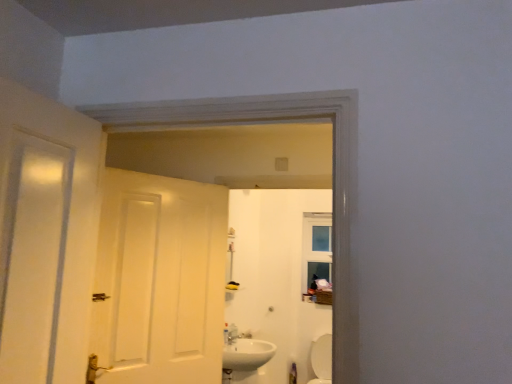
Question: Is white glossy sink at lower center next to white glossy toilet at lower right and touching it?

Choices:
 (A) no
 (B) yes

Answer: (A)

Question: Is white glossy sink at lower center wider than white glossy toilet at lower right?

Choices:
 (A) yes
 (B) no

Answer: (B)

Question: From a real-world perspective, is white glossy sink at lower center positioned over white glossy toilet at lower right based on gravity?

Choices:
 (A) yes
 (B) no

Answer: (A)

Question: Is white glossy sink at lower center far from white glossy toilet at lower right?

Choices:
 (A) yes
 (B) no

Answer: (A)

Question: Is white glossy sink at lower center bigger than white glossy toilet at lower right?

Choices:
 (A) no
 (B) yes

Answer: (A)

Question: From a real-world perspective, is white glossy toilet at lower right physically located above or below white glossy mirror at upper center?

Choices:
 (A) above
 (B) below

Answer: (B)

Question: From the image's perspective, is white glossy toilet at lower right positioned above or below white glossy mirror at upper center?

Choices:
 (A) above
 (B) below

Answer: (B)

Question: Would you say white glossy toilet at lower right is to the left or to the right of white glossy mirror at upper center in the picture?

Choices:
 (A) right
 (B) left

Answer: (A)

Question: Is white glossy toilet at lower right inside the boundaries of white glossy mirror at upper center, or outside?

Choices:
 (A) inside
 (B) outside

Answer: (B)

Question: Visually, is white matte door at center positioned to the left or to the right of white glossy sink at lower center?

Choices:
 (A) left
 (B) right

Answer: (A)

Question: In terms of size, does white matte door at center appear bigger or smaller than white glossy sink at lower center?

Choices:
 (A) big
 (B) small

Answer: (A)

Question: Relative to white glossy sink at lower center, is white matte door at center in front or behind?

Choices:
 (A) behind
 (B) front

Answer: (B)

Question: From the image's perspective, is white matte door at center above or below white glossy sink at lower center?

Choices:
 (A) above
 (B) below

Answer: (A)

Question: In terms of width, does white glossy toilet at lower right look wider or thinner when compared to white glossy sink at lower center?

Choices:
 (A) thin
 (B) wide

Answer: (B)

Question: In terms of height, does white glossy toilet at lower right look taller or shorter compared to white glossy sink at lower center?

Choices:
 (A) tall
 (B) short

Answer: (A)